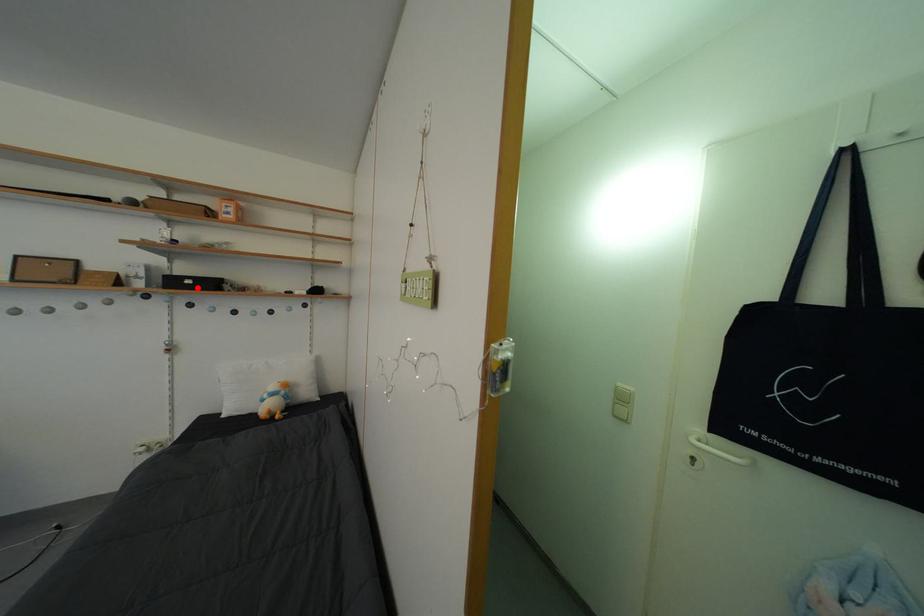
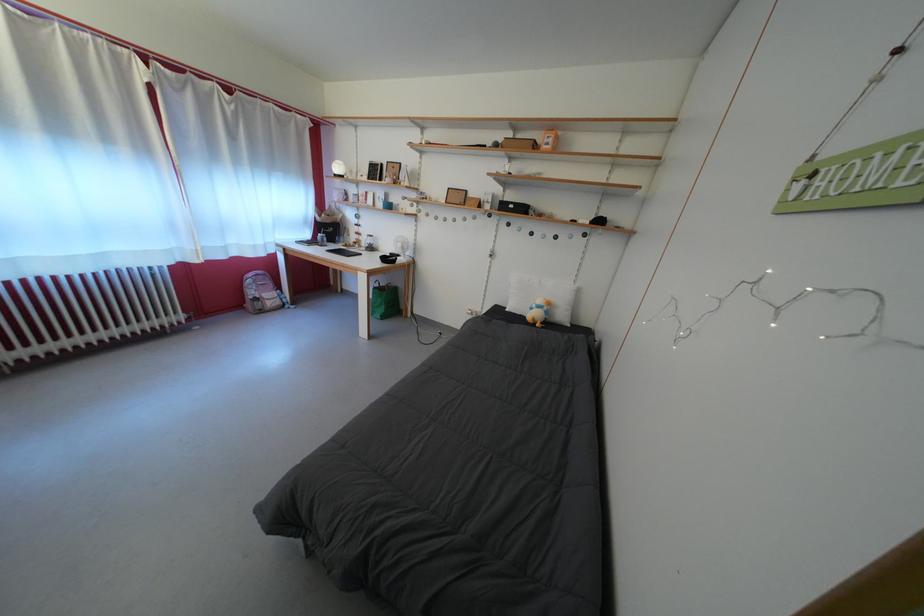
The point at the highlighted location is marked in the first image. Where is the corresponding point in the second image?

(519, 213)